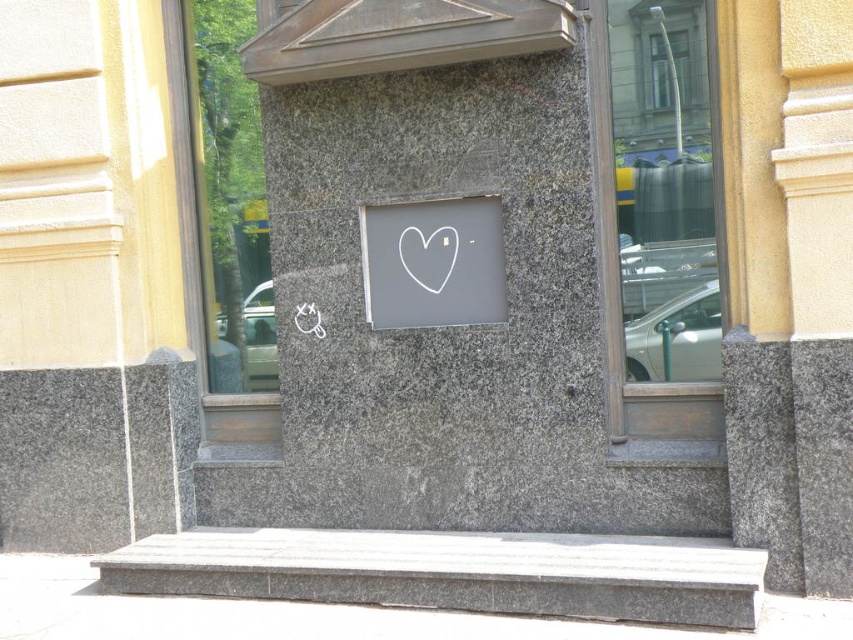
You are standing in front of the stone wall and want to place a sticker exactly where the white chalk heart at center is drawn. According to the coordinates provided, where should you place the sticker?

The white chalk heart at center is located at point (433, 262), so you should place the sticker at those coordinates to match its position.